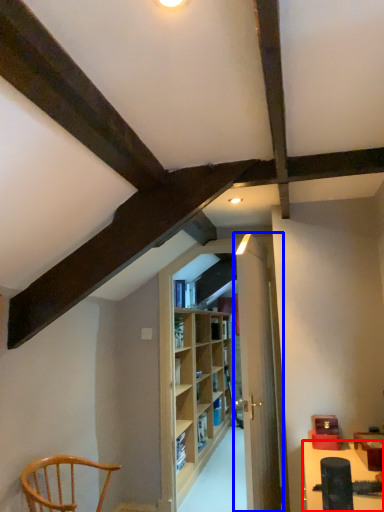
Question: Which object is closer to the camera taking this photo, table (highlighted by a red box) or door (highlighted by a blue box)?

Choices:
 (A) table
 (B) door

Answer: (A)